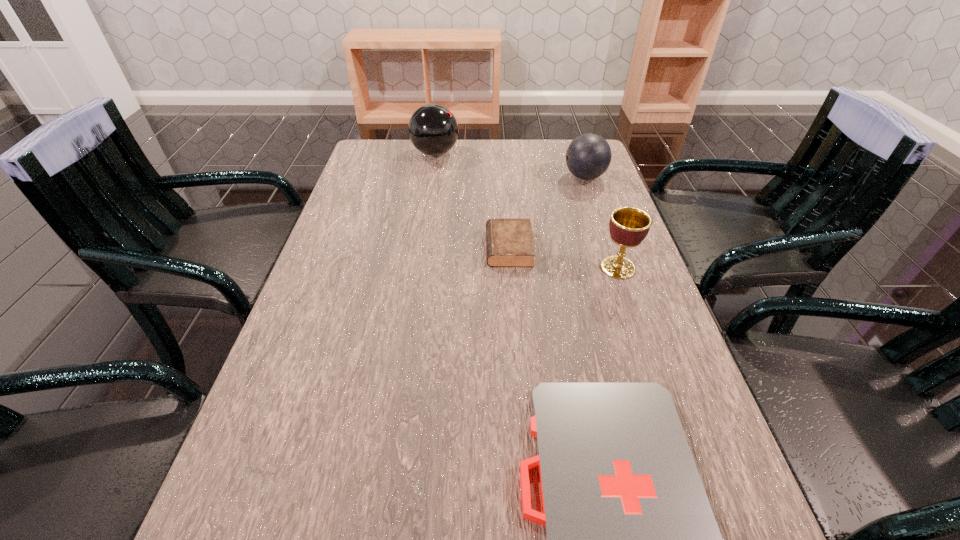
Identify the location of vacant region located 0.370m on the grip area of the nearer bowling ball. (441, 177).

This screenshot has height=540, width=960. I want to click on vacant space located 0.100m on the spine side of the second shortest object, so click(445, 248).

The image size is (960, 540). Find the location of `vacant area situated 0.110m on the spine side of the second shortest object`. vacant area situated 0.110m on the spine side of the second shortest object is located at coordinates (442, 248).

Locate an element on the screen. This screenshot has width=960, height=540. free region located 0.080m on the spine side of the second shortest object is located at coordinates click(x=454, y=248).

At what (x,y) coordinates should I click in order to perform the action: click on object that is at the left edge. Please return your answer as a coordinate pair (x, y). Image resolution: width=960 pixels, height=540 pixels. Looking at the image, I should click on click(433, 129).

Where is `chalice positioned at the right edge`? The height and width of the screenshot is (540, 960). chalice positioned at the right edge is located at coordinates (628, 226).

Image resolution: width=960 pixels, height=540 pixels. What are the coordinates of `bowling ball that is at the right edge` in the screenshot? It's located at (588, 156).

The width and height of the screenshot is (960, 540). Identify the location of object that is at the far left corner. (433, 129).

Where is `object that is at the far right corner`? The width and height of the screenshot is (960, 540). object that is at the far right corner is located at coordinates 588,156.

Image resolution: width=960 pixels, height=540 pixels. In order to click on free space at the far edge in this screenshot , I will do `click(480, 160)`.